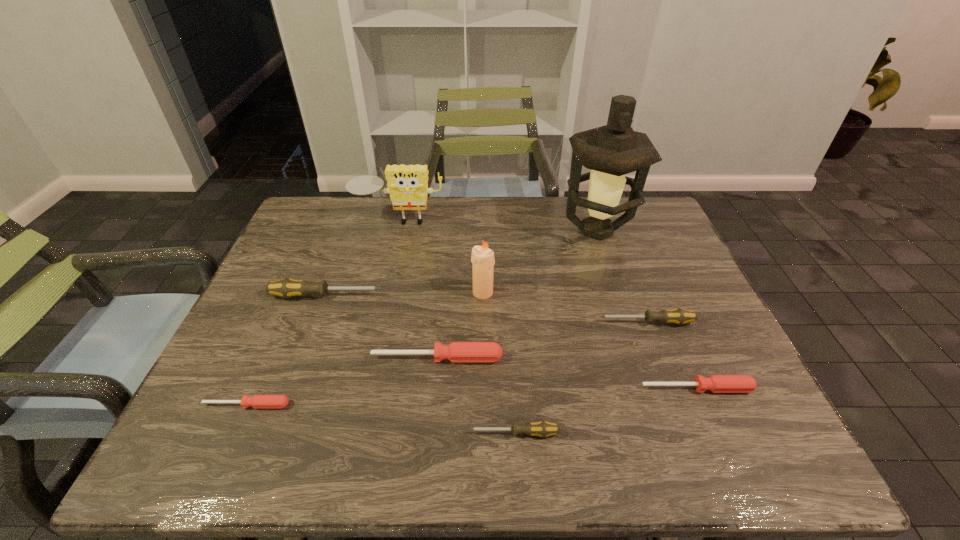
Where is `object present at the near edge`? This screenshot has width=960, height=540. object present at the near edge is located at coordinates (543, 429).

Where is `oil lamp that is at the right edge`? The image size is (960, 540). oil lamp that is at the right edge is located at coordinates (611, 151).

The height and width of the screenshot is (540, 960). Identify the location of object located at the far right corner. (611, 151).

The width and height of the screenshot is (960, 540). Find the location of `free point at the far edge`. free point at the far edge is located at coordinates (353, 214).

Find the location of a particular element. Image resolution: width=960 pixels, height=540 pixels. vacant position at the near edge of the desktop is located at coordinates (369, 429).

This screenshot has height=540, width=960. In the image, there is a desktop. Find the location of `vacant space at the right edge`. vacant space at the right edge is located at coordinates (695, 371).

This screenshot has width=960, height=540. I want to click on free location at the far left corner of the desktop, so click(x=302, y=227).

The image size is (960, 540). I want to click on vacant point at the far right corner, so click(x=648, y=225).

Image resolution: width=960 pixels, height=540 pixels. Find the location of `vacant point located between the fourth nearest object and the candle`. vacant point located between the fourth nearest object and the candle is located at coordinates (460, 325).

The height and width of the screenshot is (540, 960). In order to click on free space between the nearest screwdriver and the candle in this screenshot , I will do `click(498, 363)`.